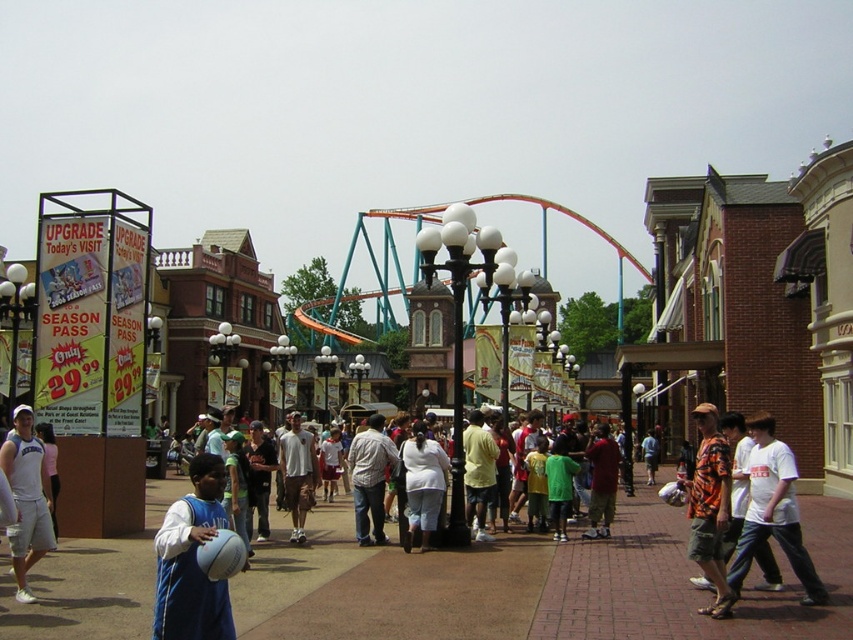
In the scene shown: Can you confirm if blue jersey at center is positioned below orange printed shirt at center?

Yes, blue jersey at center is below orange printed shirt at center.

Does blue jersey at center have a lesser height compared to orange printed shirt at center?

Yes, blue jersey at center is shorter than orange printed shirt at center.

Is point (178, 538) in front of point (711, 486)?

Yes, it is.

Image resolution: width=853 pixels, height=640 pixels. I want to click on blue jersey at center, so click(190, 561).

The width and height of the screenshot is (853, 640). What do you see at coordinates (422, 484) in the screenshot?
I see `white matte pants at center` at bounding box center [422, 484].

Is point (428, 524) more distant than point (312, 474)?

No, it is not.

Find the location of a particular element. The width and height of the screenshot is (853, 640). white matte pants at center is located at coordinates (422, 484).

Between orange printed shirt at center and plaid shirt at center, which one appears on the right side from the viewer's perspective?

orange printed shirt at center is more to the right.

Can you confirm if orange printed shirt at center is taller than plaid shirt at center?

Correct, orange printed shirt at center is much taller as plaid shirt at center.

Measure the distance between orange printed shirt at center and camera.

orange printed shirt at center and camera are 140.57 feet apart.

Where is `orange printed shirt at center`? The image size is (853, 640). orange printed shirt at center is located at coordinates (711, 508).